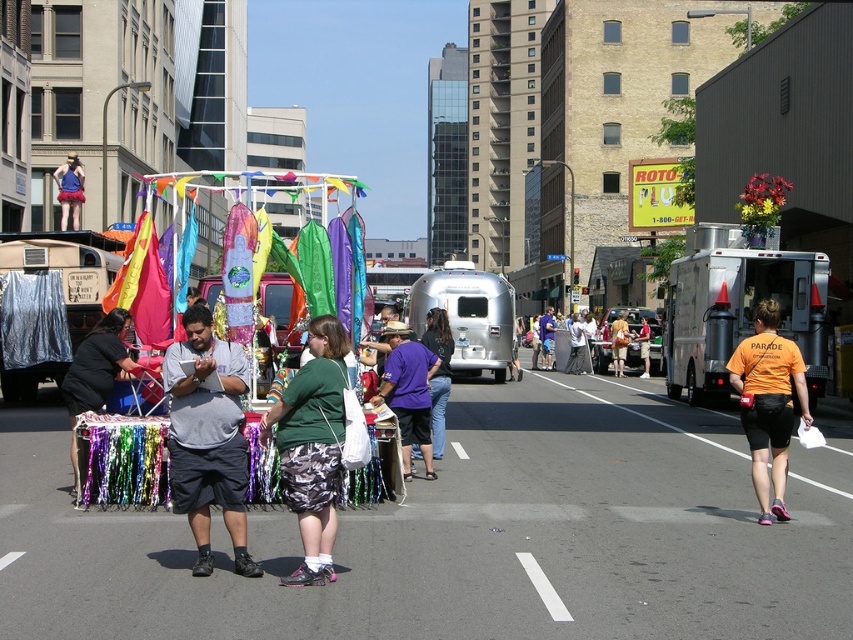
Question: Which is nearer to the silver metallic trailer at center?

Choices:
 (A) camouflage shorts at center
 (B) gray fabric stall at center
 (C) orange fabric at center

Answer: (B)

Question: Is silver metallic food truck at center-right above gray fabric stall at center?

Choices:
 (A) yes
 (B) no

Answer: (A)

Question: Estimate the real-world distances between objects in this image. Which object is farther from the camouflage shorts at center?

Choices:
 (A) orange fabric at center
 (B) silver metallic food truck at center-right
 (C) silver metallic trailer at center
 (D) gray fabric stall at center

Answer: (B)

Question: Is camouflage shorts at center positioned before orange fabric at center?

Choices:
 (A) no
 (B) yes

Answer: (B)

Question: Among these points, which one is farthest from the camera?

Choices:
 (A) click(215, 358)
 (B) click(778, 472)

Answer: (B)

Question: In this image, where is silver metallic food truck at center-right located relative to silver metallic trailer at center?

Choices:
 (A) right
 (B) left

Answer: (A)